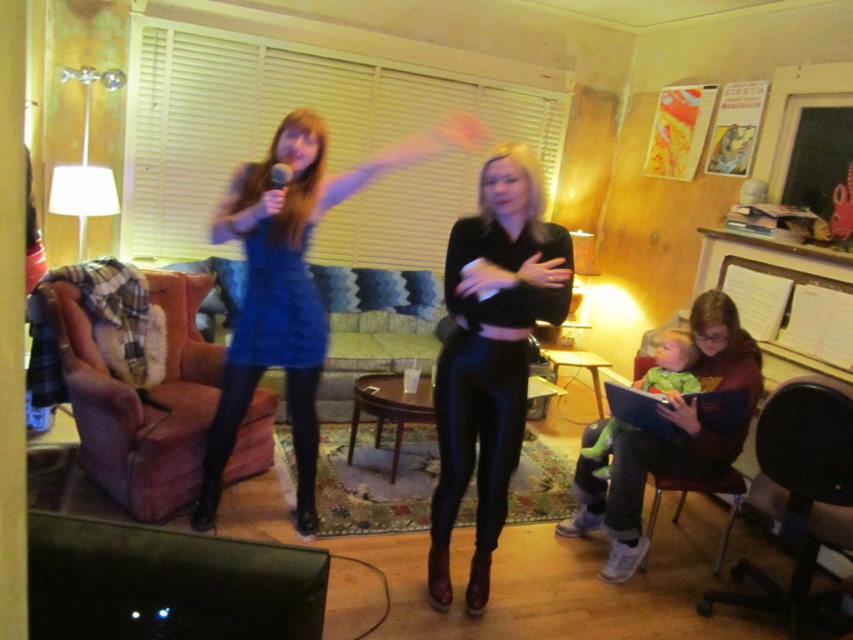
Looking at this image, you are a photographer setting up a shoot in this living room. You need to position a large equipment box that is 1.2 meters wide. Can the space between the blue shiny dress at center and the black leather armchair at lower right accommodate this box?

The blue shiny dress at center is larger in size than the black leather armchair at lower right, but the exact distance between them isn not specified. Without knowing the distance, it is impossible to determine if the 1.2 meter box will fit.

You are planning to place a new rectangular coffee table in the living room. The coffee table is 1.2 meters wide. You want to ensure it doesn t block the path between the blue shiny dress at center and the black leather armchair at lower right. Based on their widths, can the coffee table fit between them without overlapping?

The blue shiny dress at center is wider than the black leather armchair at lower right. Since the coffee table is 1.2 meters wide, it depends on the actual space between them. However, since the description only mentions their widths and not the distance between them, we cannot determine if the coffee table will fit solely based on width comparisons. More information about the distance between the two objects is needed.

You are a photographer standing at the entrance of the living room. You want to take a photo of the blue shiny dress at center and the plush pink armchair at left. Based on their positions, which object is closer to the camera?

The blue shiny dress at center is closer to the camera because it is in front of the plush pink armchair at left.